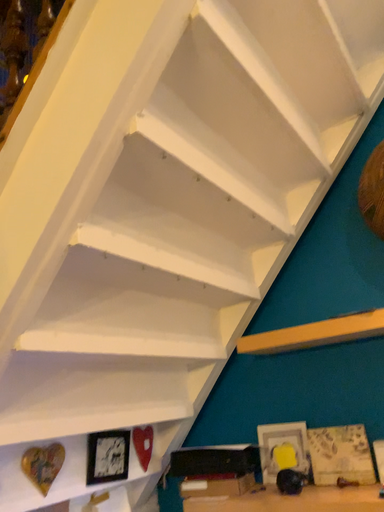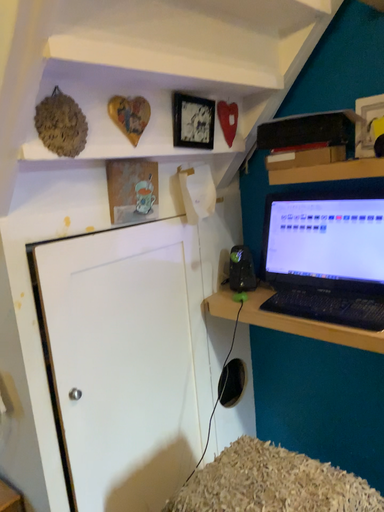
Question: How did the camera likely rotate when shooting the video?

Choices:
 (A) rotated left
 (B) rotated right

Answer: (A)